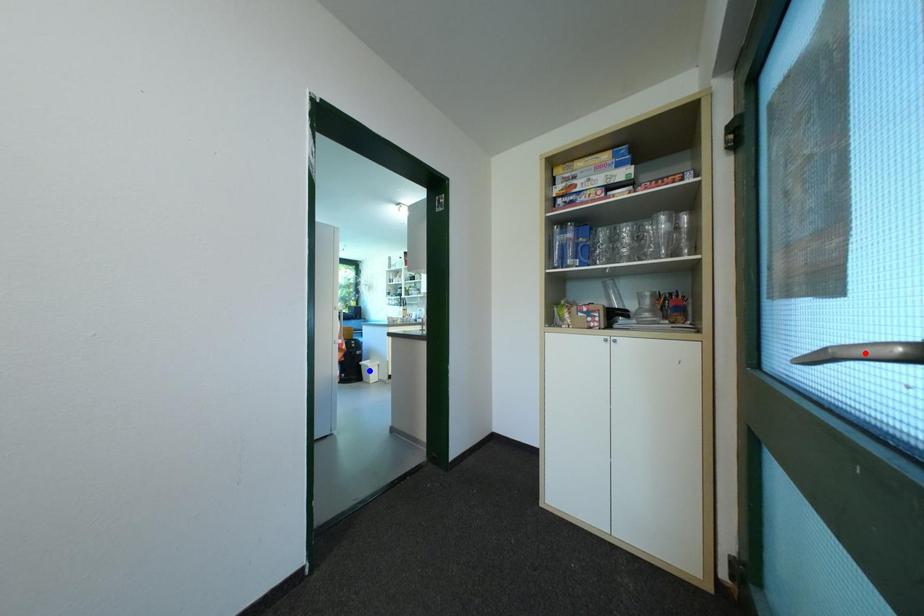
Question: Two points are marked on the image. Which point is closer to the camera?

Choices:
 (A) Blue point is closer.
 (B) Red point is closer.

Answer: (B)